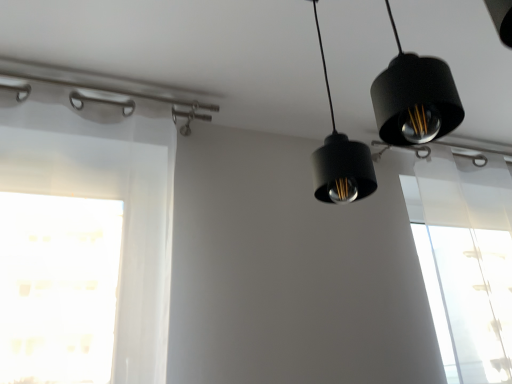
What do you see at coordinates (415, 99) in the screenshot? This screenshot has width=512, height=384. I see `black matte pendant light at upper center` at bounding box center [415, 99].

Where is `black matte pendant light at upper center`? black matte pendant light at upper center is located at coordinates (415, 99).

Measure the distance between point (x=442, y=109) and camera.

A distance of 60.00 centimeters exists between point (x=442, y=109) and camera.

What do you see at coordinates (465, 260) in the screenshot?
I see `transparent fabric at upper right` at bounding box center [465, 260].

Measure the distance between transparent fabric at upper right and camera.

The distance of transparent fabric at upper right from camera is 1.39 meters.

This screenshot has height=384, width=512. What are the coordinates of `transparent fabric at upper right` in the screenshot? It's located at (465, 260).

Locate an element on the screen. This screenshot has height=384, width=512. black matte pendant light at upper center is located at coordinates (415, 99).

Is transparent fabric at upper right to the right of black matte pendant light at upper center from the viewer's perspective?

Yes.

Who is more distant, transparent fabric at upper right or black matte pendant light at upper center?

transparent fabric at upper right is further away from the camera.

Which point is more distant from viewer, (423,171) or (368,194)?

The point (423,171) is behind.

From the image's perspective, which one is positioned lower, transparent fabric at upper right or black matte pendant light at upper center?

transparent fabric at upper right appears lower in the image.

From a real-world perspective, does transparent fabric at upper right stand above black matte pendant light at upper center?

No, from a real-world perspective, transparent fabric at upper right is not on top of black matte pendant light at upper center.

Considering the sizes of transparent fabric at upper right and black matte pendant light at upper center in the image, is transparent fabric at upper right wider or thinner than black matte pendant light at upper center?

Considering their sizes, transparent fabric at upper right looks slimmer than black matte pendant light at upper center.

In terms of height, does transparent fabric at upper right look taller or shorter compared to black matte pendant light at upper center?

Considering their sizes, transparent fabric at upper right has more height than black matte pendant light at upper center.

Who is smaller, transparent fabric at upper right or black matte pendant light at upper center?

black matte pendant light at upper center is smaller.

Can we say transparent fabric at upper right lies outside black matte pendant light at upper center?

transparent fabric at upper right is positioned outside black matte pendant light at upper center.

Would you consider transparent fabric at upper right to be distant from black matte pendant light at upper center?

Yes, transparent fabric at upper right is far from black matte pendant light at upper center.

Is transparent fabric at upper right aimed at black matte pendant light at upper center?

No.

Where is `window behind the black matte pendant light at upper center`? This screenshot has height=384, width=512. window behind the black matte pendant light at upper center is located at coordinates (465, 260).

Which is more to the right, black matte pendant light at upper center or transparent fabric at upper right?

transparent fabric at upper right is more to the right.

Which object is closer to the camera taking this photo, black matte pendant light at upper center or transparent fabric at upper right?

black matte pendant light at upper center is in front.

Between point (424, 65) and point (430, 246), which one is positioned in front?

Point (424, 65)

From the image's perspective, who appears lower, black matte pendant light at upper center or transparent fabric at upper right?

transparent fabric at upper right is shown below in the image.

From a real-world perspective, who is located higher, black matte pendant light at upper center or transparent fabric at upper right?

black matte pendant light at upper center is physically above.

Looking at their sizes, would you say black matte pendant light at upper center is wider or thinner than transparent fabric at upper right?

Considering their sizes, black matte pendant light at upper center looks broader than transparent fabric at upper right.

Who is shorter, black matte pendant light at upper center or transparent fabric at upper right?

Standing shorter between the two is black matte pendant light at upper center.

Can you confirm if black matte pendant light at upper center is bigger than transparent fabric at upper right?

No, black matte pendant light at upper center is not bigger than transparent fabric at upper right.

Is black matte pendant light at upper center spatially inside transparent fabric at upper right, or outside of it?

black matte pendant light at upper center is not enclosed by transparent fabric at upper right.

Looking at this image, is black matte pendant light at upper center beside transparent fabric at upper right?

No, black matte pendant light at upper center is not in contact with transparent fabric at upper right.

Looking at this image, does black matte pendant light at upper center turn towards transparent fabric at upper right?

No, black matte pendant light at upper center is not turned towards transparent fabric at upper right.

You are a GUI agent. You are given a task and a screenshot of the screen. Output one action in this format:
    pyautogui.click(x=<x>, y=<y>)
    Task: Click on the window beneath the black matte pendant light at upper center (from a real-world perspective)
    This screenshot has width=512, height=384.
    Given the screenshot: What is the action you would take?
    pyautogui.click(x=465, y=260)

Locate an element on the screen. The height and width of the screenshot is (384, 512). window that appears below the black matte pendant light at upper center (from the image's perspective) is located at coordinates (x=465, y=260).

Where is `window below the black matte pendant light at upper center (from a real-world perspective)`? window below the black matte pendant light at upper center (from a real-world perspective) is located at coordinates (465, 260).